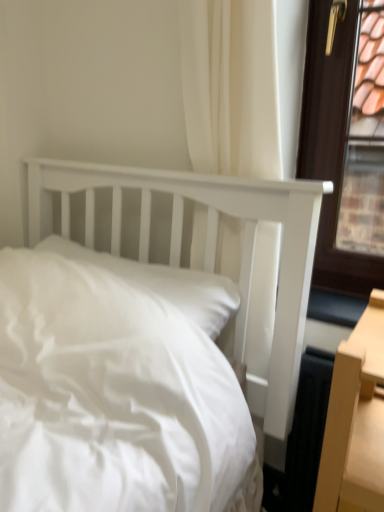
Question: In terms of width, does white fabric curtain at upper center look wider or thinner when compared to white smooth pillow at center?

Choices:
 (A) thin
 (B) wide

Answer: (A)

Question: Which is correct: white fabric curtain at upper center is inside white smooth pillow at center, or outside of it?

Choices:
 (A) outside
 (B) inside

Answer: (A)

Question: From a real-world perspective, is white fabric curtain at upper center positioned above or below white smooth pillow at center?

Choices:
 (A) above
 (B) below

Answer: (A)

Question: Do you think white smooth pillow at center is within white fabric curtain at upper center, or outside of it?

Choices:
 (A) outside
 (B) inside

Answer: (A)

Question: Is white smooth pillow at center bigger or smaller than white fabric curtain at upper center?

Choices:
 (A) big
 (B) small

Answer: (B)

Question: Would you say white smooth pillow at center is to the left or to the right of white fabric curtain at upper center in the picture?

Choices:
 (A) left
 (B) right

Answer: (A)

Question: Looking at their shapes, would you say white smooth pillow at center is wider or thinner than white fabric curtain at upper center?

Choices:
 (A) wide
 (B) thin

Answer: (A)